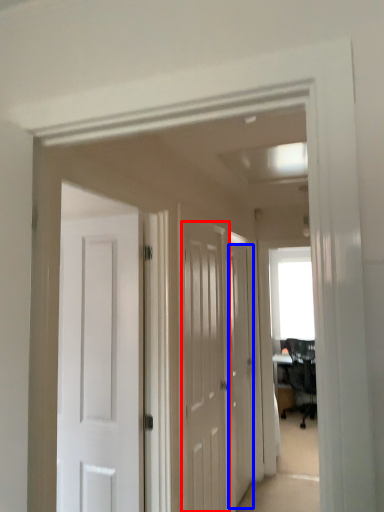
Question: Which object is further to the camera taking this photo, door (highlighted by a red box) or door (highlighted by a blue box)?

Choices:
 (A) door
 (B) door

Answer: (B)